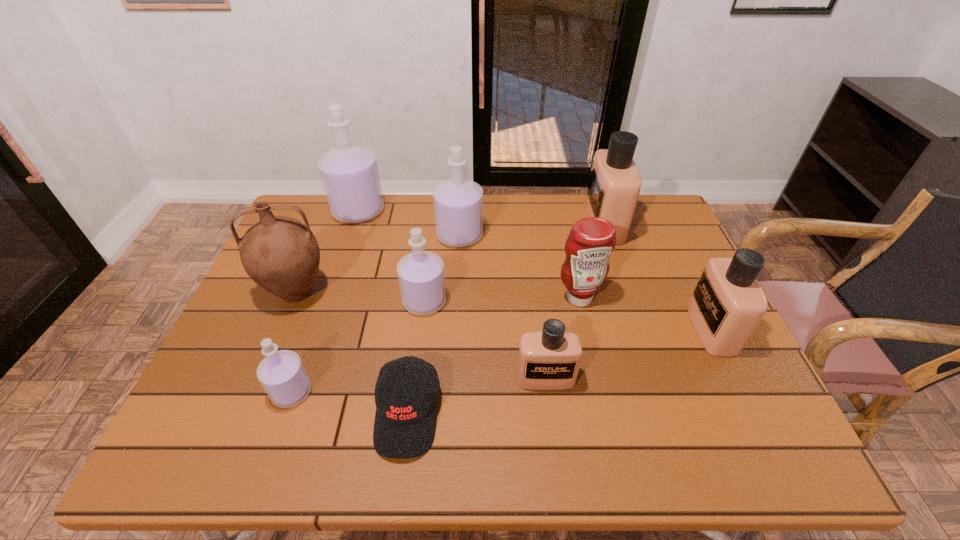
You are a GUI agent. You are given a task and a screenshot of the screen. Output one action in this format:
    pyautogui.click(x=<x>, y=<y>)
    Task: Click on the object at the right edge
    
    Given the screenshot: What is the action you would take?
    pos(727,304)

Locate an element on the screen. The width and height of the screenshot is (960, 540). object situated at the far left corner is located at coordinates (349, 173).

At what (x,y) coordinates should I click in order to perform the action: click on free location at the far edge. Please return your answer as a coordinate pair (x, y). The height and width of the screenshot is (540, 960). Looking at the image, I should click on (422, 200).

Where is `free space at the near edge of the desktop`? Image resolution: width=960 pixels, height=540 pixels. free space at the near edge of the desktop is located at coordinates (628, 424).

At what (x,y) coordinates should I click in order to perform the action: click on vacant space at the left edge of the desktop. Please return your answer as a coordinate pair (x, y). Looking at the image, I should click on (241, 348).

The image size is (960, 540). In the image, there is a desktop. Find the location of `vacant space at the right edge`. vacant space at the right edge is located at coordinates (663, 316).

Locate an element on the screen. The height and width of the screenshot is (540, 960). free space at the near right corner of the desktop is located at coordinates (783, 435).

The image size is (960, 540). I want to click on free area in between the smallest purple perfume and the farthest beige perfume, so 448,308.

Where is `free spot between the smallest beige perfume and the tallest object`? The width and height of the screenshot is (960, 540). free spot between the smallest beige perfume and the tallest object is located at coordinates (452, 294).

Where is `free spot between the third smallest purple perfume and the condiment`? The height and width of the screenshot is (540, 960). free spot between the third smallest purple perfume and the condiment is located at coordinates (519, 267).